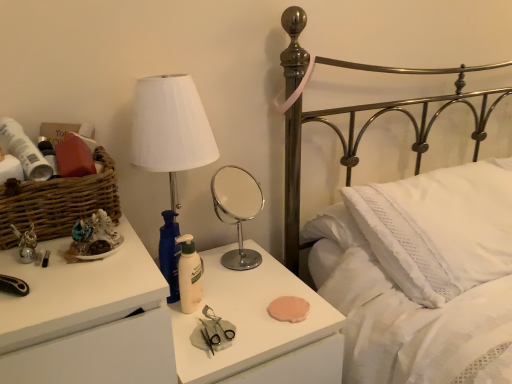
The height and width of the screenshot is (384, 512). What are the coordinates of `blank space above matte plastic lotion at center, which is the second nightstand in left-to-right order (from a real-world perspective)` in the screenshot? It's located at (236, 294).